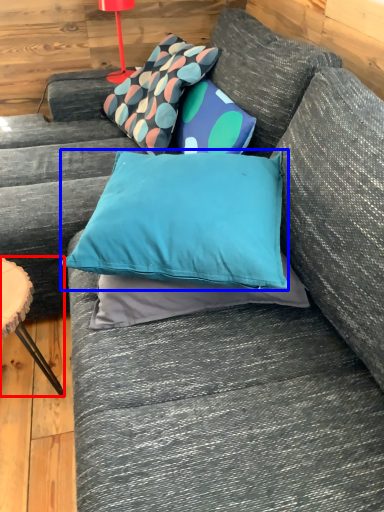
Question: Which point is further to the camera, furniture (highlighted by a red box) or pillow (highlighted by a blue box)?

Choices:
 (A) furniture
 (B) pillow

Answer: (A)